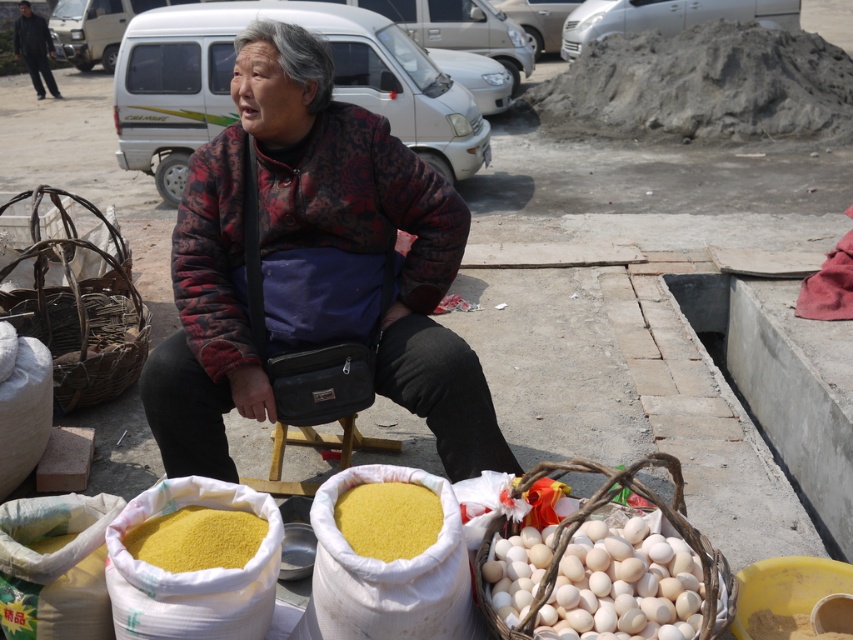
Question: Is patterned fabric jacket at center in front of yellow powder at lower center?

Choices:
 (A) no
 (B) yes

Answer: (A)

Question: Which point is closer to the camera taking this photo?

Choices:
 (A) (352, 490)
 (B) (251, 531)
 (C) (112, 273)
 (D) (277, 230)

Answer: (B)

Question: Which point appears closest to the camera in this image?

Choices:
 (A) (479, 428)
 (B) (227, 560)
 (C) (49, 333)

Answer: (B)

Question: Where is woven brown basket at left located in relation to yellow powder at lower center in the image?

Choices:
 (A) above
 (B) below

Answer: (A)

Question: Can you confirm if patterned fabric jacket at center is positioned above yellow powder at lower center?

Choices:
 (A) no
 (B) yes

Answer: (B)

Question: Among these objects, which one is farthest from the camera?

Choices:
 (A) yellow powder at lower left
 (B) woven brown basket at left
 (C) patterned fabric jacket at center

Answer: (B)